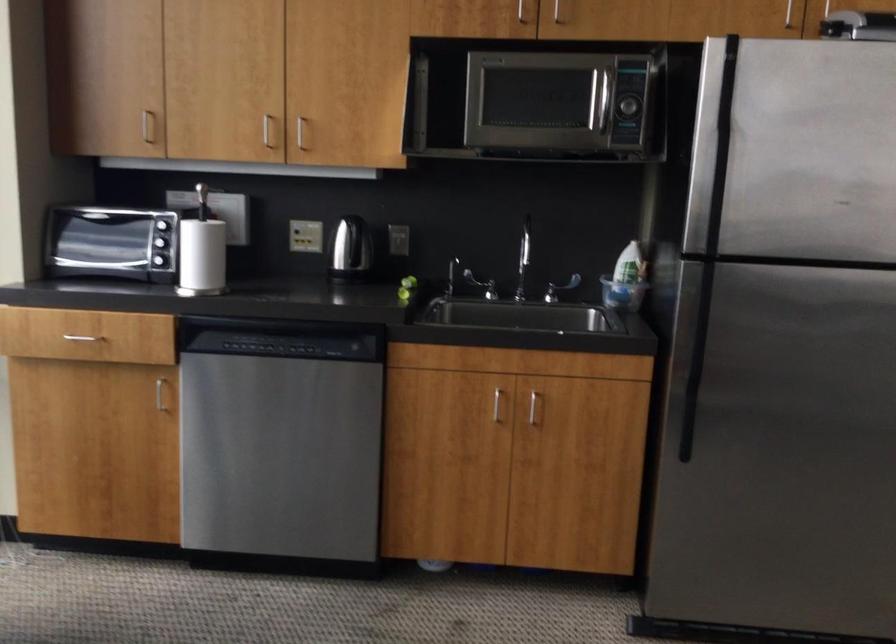
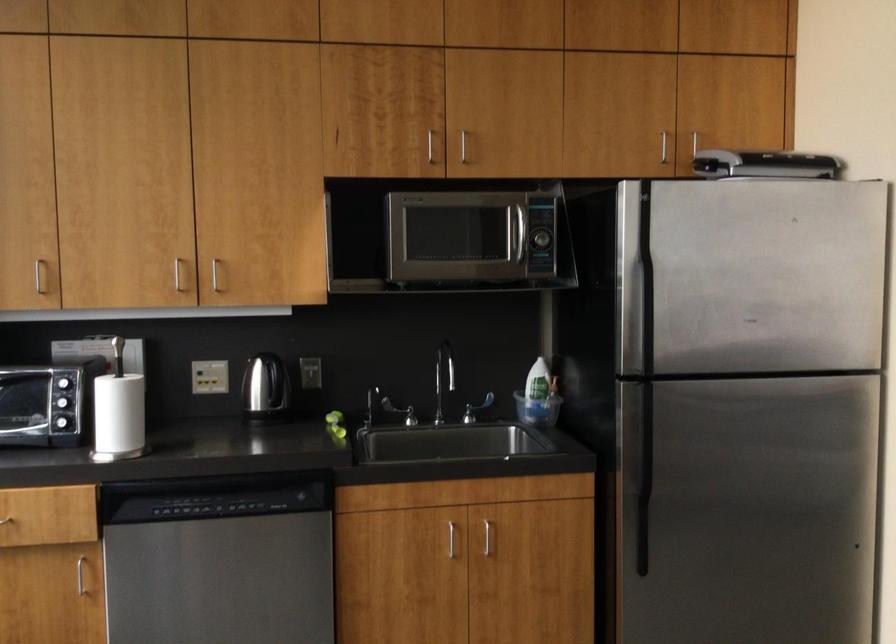
In the second image, find the point that corresponds to [626,275] in the first image.

(539, 391)